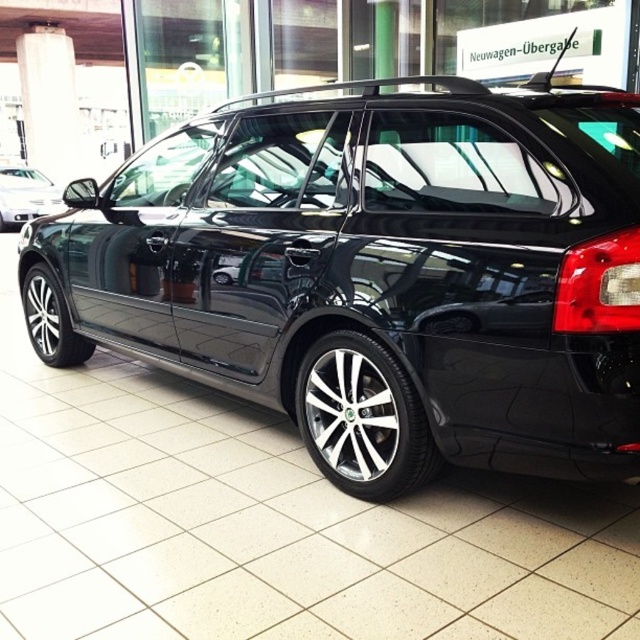
Between point (374, 451) and point (51, 209), which one is positioned behind?

The point (51, 209) is behind.

How far apart are glossy black car at center and matte black car at left?

glossy black car at center is 10.61 meters away from matte black car at left.

Who is more forward, [132,342] or [17,170]?

Point [132,342] is in front.

In order to click on glossy black car at center in this screenshot , I will do `click(376, 273)`.